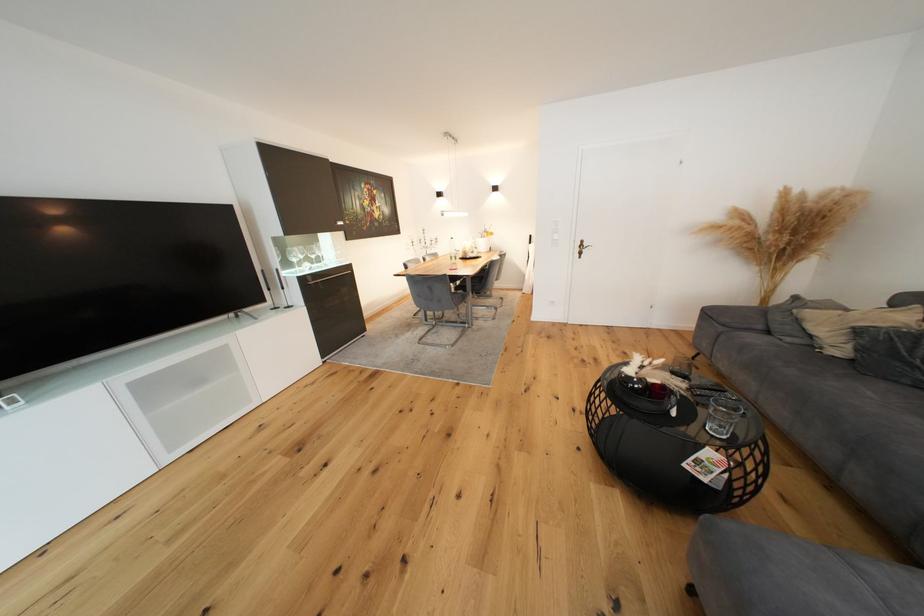
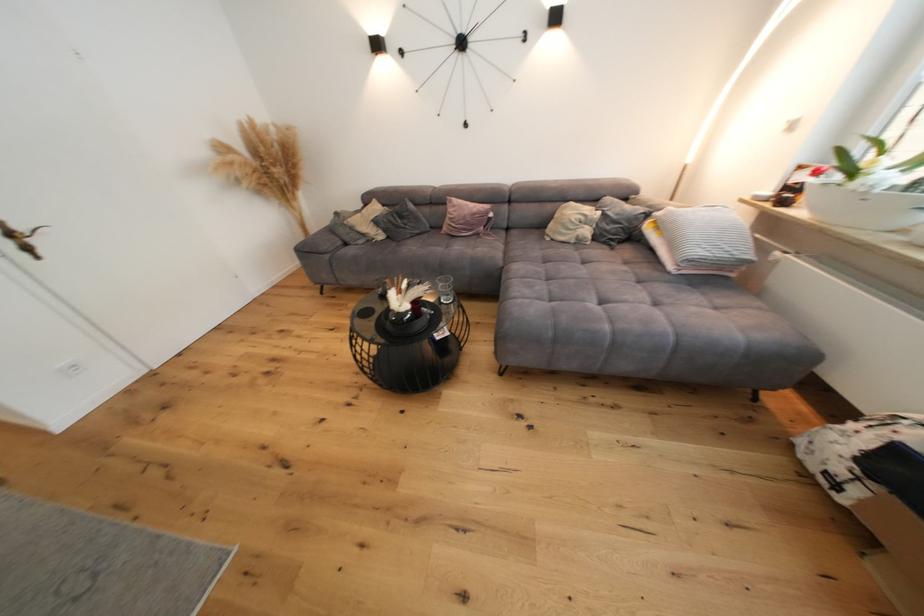
Find the pixel in the second image that matches (783,329) in the first image.

(354, 240)